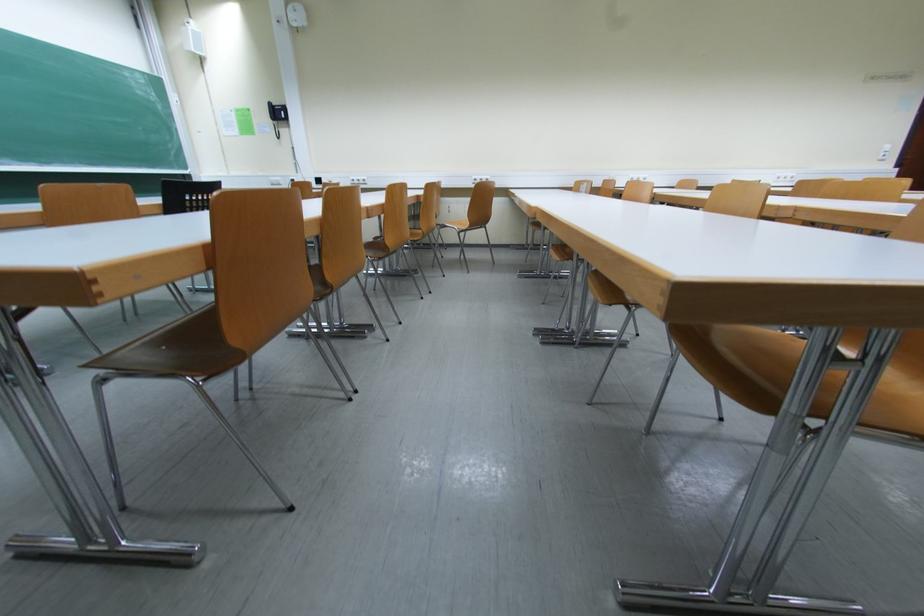
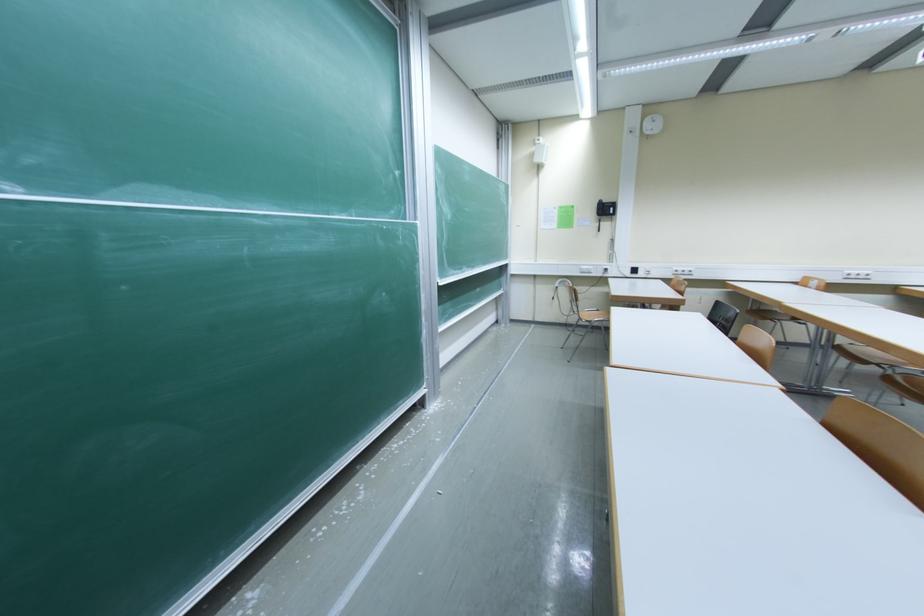
Question: In a continuous first-person perspective shot, in which direction is the camera moving?

Choices:
 (A) Left
 (B) Right
 (C) Forward
 (D) Backward

Answer: (A)